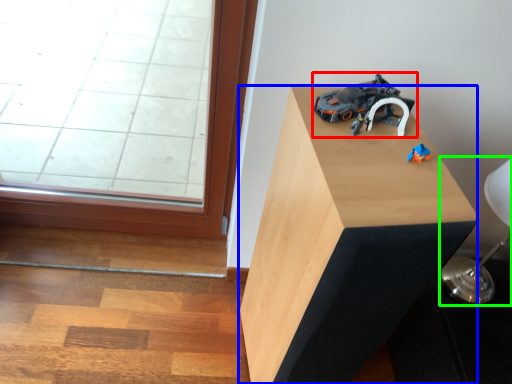
Question: Estimate the real-world distances between objects in this image. Which object is closer to toy (highlighted by a red box), furniture (highlighted by a blue box) or table lamp (highlighted by a green box)?

Choices:
 (A) furniture
 (B) table lamp

Answer: (A)